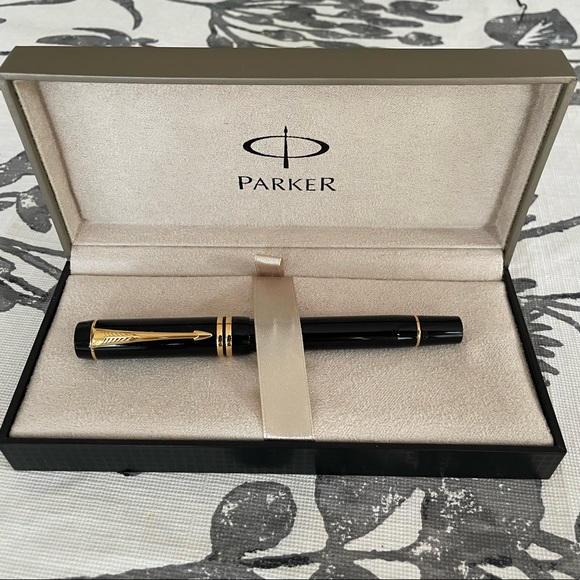
The width and height of the screenshot is (580, 580). Find the location of `suede lining`. suede lining is located at coordinates coord(425,139), coord(485,409).